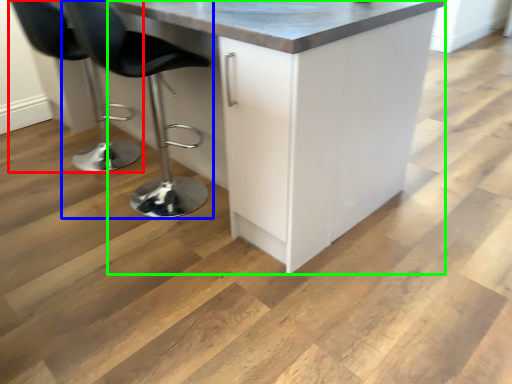
Question: Based on their relative distances, which object is nearer to chair (highlighted by a red box)? Choose from chair (highlighted by a blue box) and cabinetry (highlighted by a green box).

Choices:
 (A) chair
 (B) cabinetry

Answer: (A)